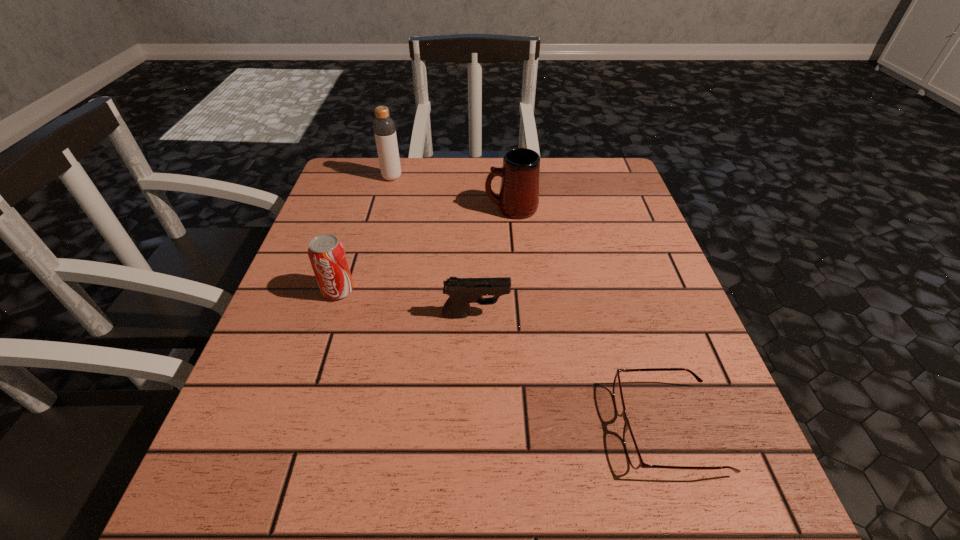
You are a GUI agent. You are given a task and a screenshot of the screen. Output one action in this format:
    pyautogui.click(x=<x>, y=<y>)
    Task: Click on the object at the near edge
    The width and height of the screenshot is (960, 540).
    Given the screenshot: What is the action you would take?
    pyautogui.click(x=634, y=457)

This screenshot has width=960, height=540. Identify the location of bottle at the left edge. (384, 127).

What are the coordinates of `soda can that is at the left edge` in the screenshot? It's located at (326, 253).

Where is `object situated at the right edge`? The width and height of the screenshot is (960, 540). object situated at the right edge is located at coordinates (634, 457).

Find the location of a particular element. The image size is (960, 540). object at the far left corner is located at coordinates (384, 127).

I want to click on object that is at the near right corner, so click(634, 457).

Locate an element on the screen. Image resolution: width=960 pixels, height=540 pixels. free space at the far edge of the desktop is located at coordinates (496, 188).

Find the location of a particular element. This screenshot has height=540, width=960. vacant area at the near edge is located at coordinates (591, 523).

Locate an element on the screen. The width and height of the screenshot is (960, 540). vacant space at the left edge of the desktop is located at coordinates (327, 219).

In the image, there is a desktop. Where is `vacant space at the right edge`? Image resolution: width=960 pixels, height=540 pixels. vacant space at the right edge is located at coordinates point(590,274).